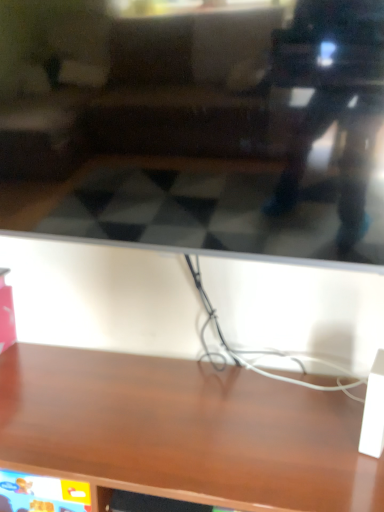
What do you see at coordinates (182, 432) in the screenshot? This screenshot has width=384, height=512. I see `brown wooden table at center` at bounding box center [182, 432].

Measure the distance between point (4, 357) and camera.

They are 4.90 feet apart.

Identify the location of brown wooden table at center. (182, 432).

What is the approximate width of brown wooden table at center?

brown wooden table at center is 23.27 inches in width.

Locate an element on the screen. Image resolution: width=384 pixels, height=512 pixels. brown wooden table at center is located at coordinates (182, 432).